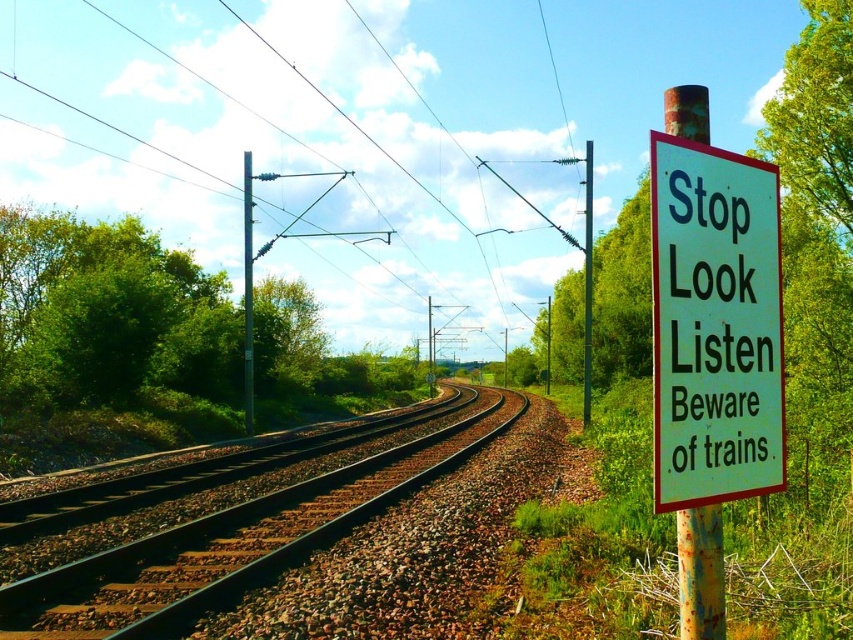
You are a pedestrian approaching the railway tracks and see the white paper sign at right and the metallic pole at center. Which object is located to the right side of the other?

The white paper sign at right is to the right of metallic pole at center.

You are a painter who wants to paint both the white paper sign at right and the brown gravel tracks at center. Which object is narrower when viewed from your perspective?

The white paper sign at right is narrower than the brown gravel tracks at center.

You are a pedestrian approaching the railway tracks and see the white paper sign at right and the rusty metal signpost at right. Which object is smaller in size?

The white paper sign at right is smaller in size compared to the rusty metal signpost at right.